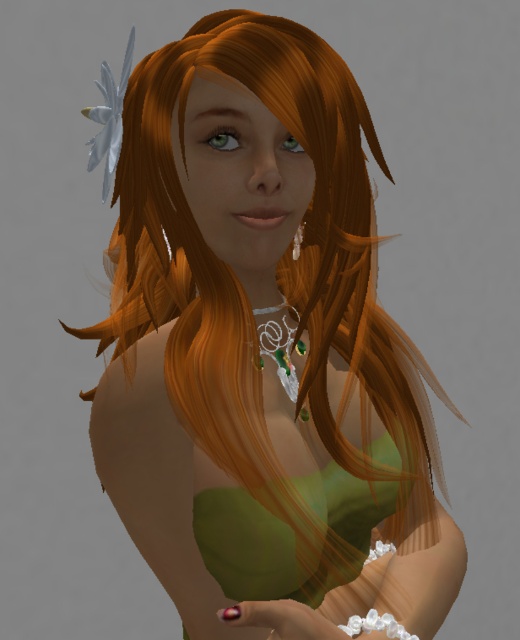
Question: Which of the following is the farthest from the observer?

Choices:
 (A) green matte dress at center
 (B) green gemstone earring at center

Answer: (B)

Question: Can you confirm if green matte dress at center is smaller than shiny pink nail polish at lower center?

Choices:
 (A) yes
 (B) no

Answer: (B)

Question: Considering the relative positions of green matte dress at center and shiny pink nail polish at lower center in the image provided, where is green matte dress at center located with respect to shiny pink nail polish at lower center?

Choices:
 (A) above
 (B) below

Answer: (A)

Question: Among these points, which one is nearest to the camera?

Choices:
 (A) (213, 515)
 (B) (300, 232)
 (C) (293, 611)

Answer: (C)

Question: Does green matte dress at center have a smaller size compared to shiny pink nail polish at lower center?

Choices:
 (A) yes
 (B) no

Answer: (B)

Question: Estimate the real-world distances between objects in this image. Which object is closer to the shiny pink nail polish at lower center?

Choices:
 (A) green gemstone earring at center
 (B) green matte dress at center

Answer: (B)